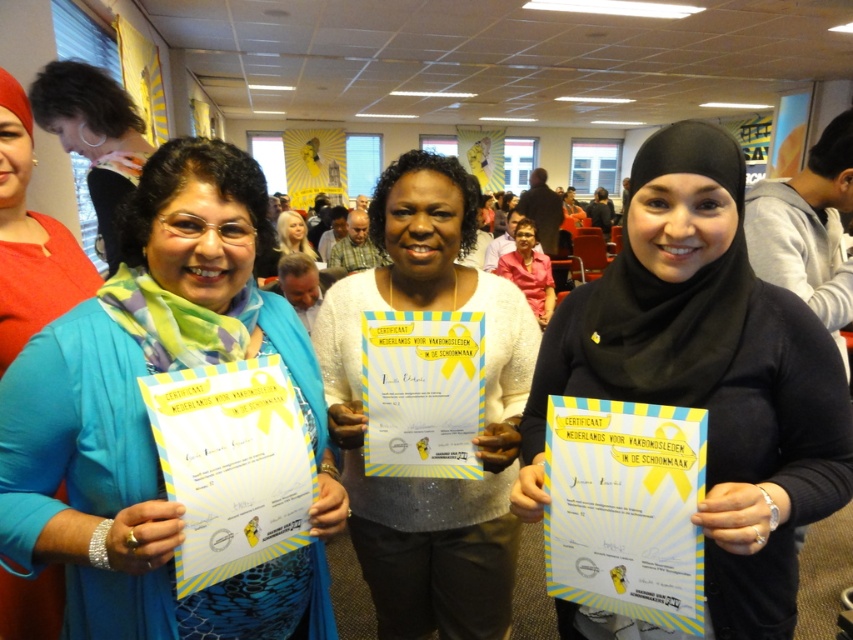
You are a photographer at the event and want to capture a clear photo of the blue fabric scarf at left and the matte black hijab at center. Which object will appear closer to the camera in the photo?

The blue fabric scarf at left will appear closer to the camera because it is in front of the matte black hijab at center.

You are a photographer at the event. You need to take a photo of the three women holding certificates. The woman with the matte black hijab at center is at point (x=708, y=372). Where should you position your camera to ensure she is centered in the frame?

Position the camera so that the center of the frame aligns with the coordinates (x=708, y=372) where the matte black hijab at center is located to ensure she is centered in the photo.

You are an attendee at the event and want to take a photo of the matte black hijab at center. Where should you position yourself to capture it in the frame?

To capture the matte black hijab at center, position yourself facing the center of the image at coordinates approximately 0.584 on the x and 0.831 on the y axis.